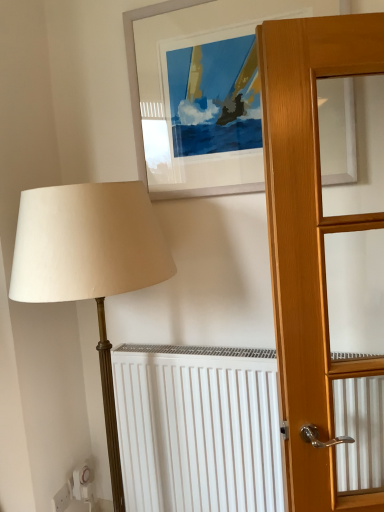
Question: From a real-world perspective, is white plastic electric outlet at lower left positioned over white matte picture frame at upper center based on gravity?

Choices:
 (A) no
 (B) yes

Answer: (A)

Question: Can you confirm if white plastic electric outlet at lower left is positioned to the right of white matte picture frame at upper center?

Choices:
 (A) no
 (B) yes

Answer: (A)

Question: Is the depth of white plastic electric outlet at lower left less than that of white matte picture frame at upper center?

Choices:
 (A) no
 (B) yes

Answer: (A)

Question: Does white plastic electric outlet at lower left have a greater width compared to white matte picture frame at upper center?

Choices:
 (A) yes
 (B) no

Answer: (B)

Question: Is there a large distance between white plastic electric outlet at lower left and white matte picture frame at upper center?

Choices:
 (A) yes
 (B) no

Answer: (A)

Question: Is white plastic electric outlet at lower left thinner than white matte picture frame at upper center?

Choices:
 (A) no
 (B) yes

Answer: (B)

Question: Considering the relative positions of white matte picture frame at upper center and white plastic electric outlet at lower left in the image provided, is white matte picture frame at upper center behind white plastic electric outlet at lower left?

Choices:
 (A) yes
 (B) no

Answer: (B)

Question: Is the position of white matte picture frame at upper center less distant than that of white plastic electric outlet at lower left?

Choices:
 (A) no
 (B) yes

Answer: (B)

Question: Is white matte picture frame at upper center bigger than white plastic electric outlet at lower left?

Choices:
 (A) no
 (B) yes

Answer: (B)

Question: Does white matte picture frame at upper center have a greater height compared to white plastic electric outlet at lower left?

Choices:
 (A) no
 (B) yes

Answer: (B)

Question: Is white matte picture frame at upper center at the left side of white plastic electric outlet at lower left?

Choices:
 (A) yes
 (B) no

Answer: (B)

Question: From the image's perspective, is white matte picture frame at upper center above white plastic electric outlet at lower left?

Choices:
 (A) no
 (B) yes

Answer: (B)

Question: Considering the positions of point (236, 146) and point (67, 501), is point (236, 146) closer or farther from the camera than point (67, 501)?

Choices:
 (A) closer
 (B) farther

Answer: (A)